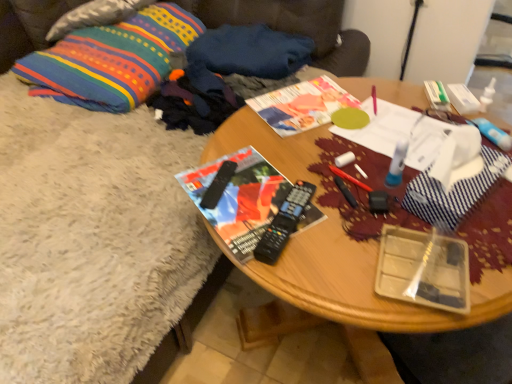
You are a GUI agent. You are given a task and a screenshot of the screen. Output one action in this format:
    pyautogui.click(x=<x>, y=<y>)
    Task: Click on the vacant area in front of black plastic remote control at center, the 1th remote control in the right-to-left sequence
    This screenshot has height=384, width=512.
    Given the screenshot: What is the action you would take?
    pyautogui.click(x=317, y=278)